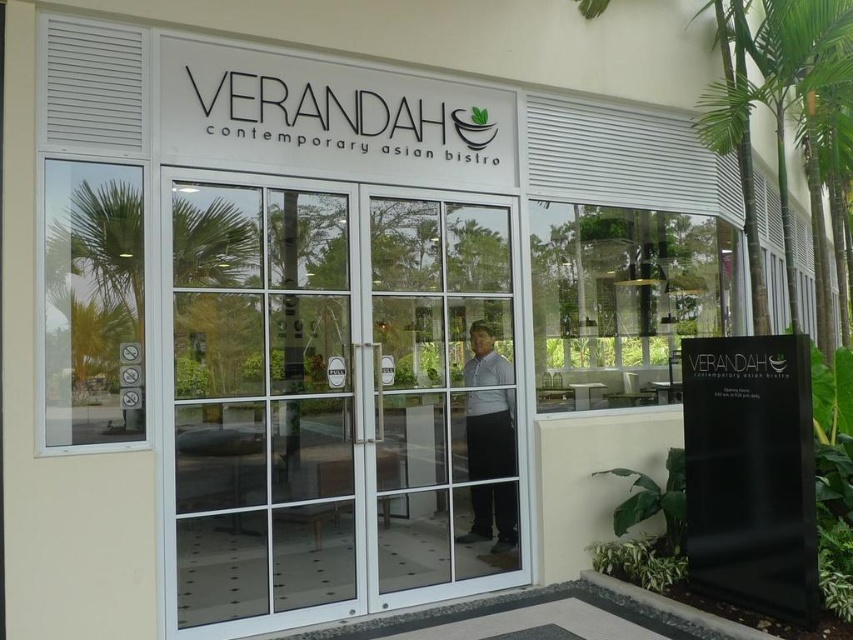
Is transparent glass door at center taller than white shirt at center?

Indeed, transparent glass door at center has a greater height compared to white shirt at center.

Can you confirm if transparent glass door at center is thinner than white shirt at center?

Incorrect, transparent glass door at center's width is not less than white shirt at center's.

Which is behind, point (193, 618) or point (502, 492)?

The point (502, 492) is behind.

The image size is (853, 640). I want to click on transparent glass door at center, so click(x=339, y=397).

Does white glass door at center appear on the left side of white shirt at center?

Indeed, white glass door at center is positioned on the left side of white shirt at center.

The height and width of the screenshot is (640, 853). Identify the location of white glass door at center. [444, 390].

Identify the location of white glass door at center. The width and height of the screenshot is (853, 640). (444, 390).

Does transparent glass door at center appear over white glass door at center?

Actually, transparent glass door at center is below white glass door at center.

Can you confirm if transparent glass door at center is shorter than white glass door at center?

No, transparent glass door at center is not shorter than white glass door at center.

The image size is (853, 640). What do you see at coordinates (339, 397) in the screenshot?
I see `transparent glass door at center` at bounding box center [339, 397].

Identify the location of transparent glass door at center. (339, 397).